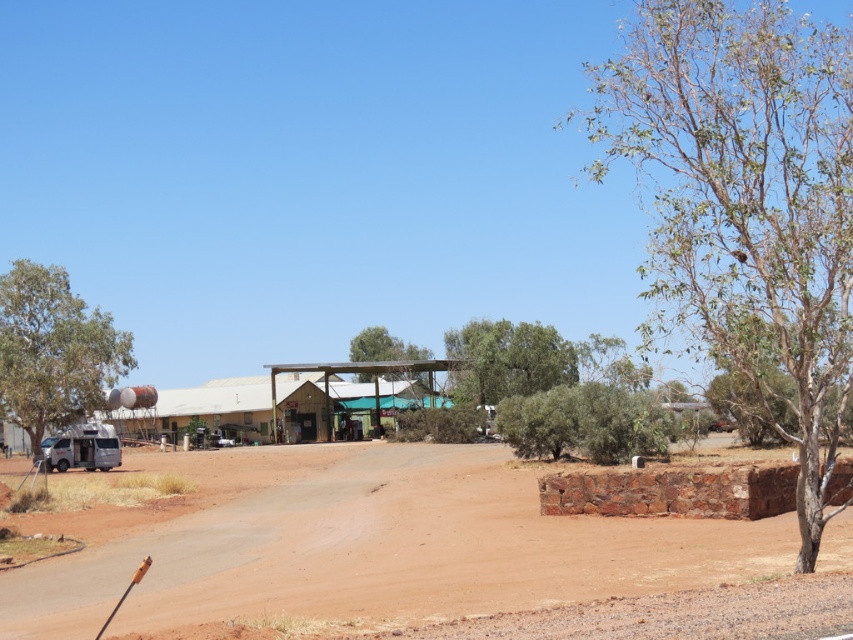
You are a traveler on a dirt road in a dry region. You see a brown textured tree at right and a green leafy tree at left. Which tree would cast a longer shadow at noon?

The brown textured tree at right has a greater height compared to the green leafy tree at left, so it would cast a longer shadow at noon.

From the picture: You are a delivery driver who needs to park your truck between the brown textured tree at right and the brown dirt field at lower left. The truck is 10 meters long. Is there enough space between them to park the truck?

The distance between the brown textured tree at right and the brown dirt field at lower left is 25.10 meters. Since the truck is 10 meters long, there is sufficient space to park between them as 25.10 meters is greater than 10 meters.